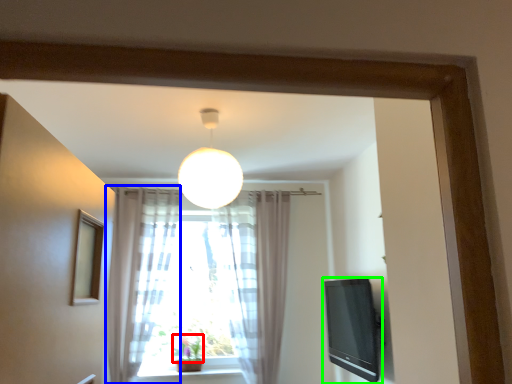
Question: Which object is positioned closest to plant (highlighted by a red box)? Select from curtain (highlighted by a blue box) and television (highlighted by a green box).

Choices:
 (A) curtain
 (B) television

Answer: (A)